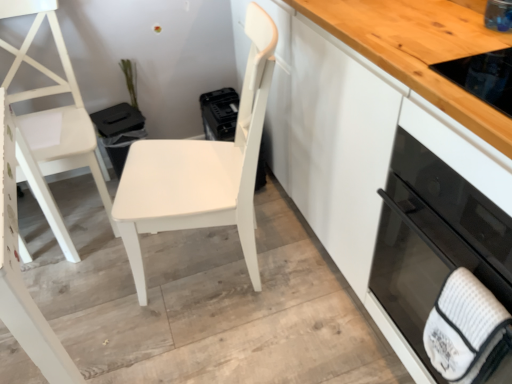
Where is `free region under white matte chair at center, the second chair from the left (from a real-world perspective)`? This screenshot has height=384, width=512. free region under white matte chair at center, the second chair from the left (from a real-world perspective) is located at coordinates (209, 259).